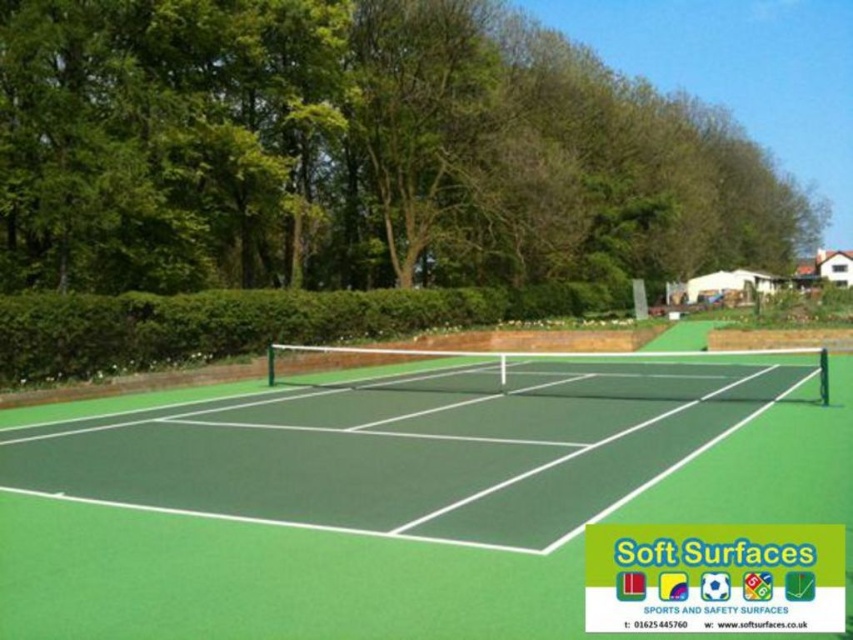
You are standing on the tennis court and want to locate the green leafy tree at upper center. According to the coordinates provided, where should you look?

The green leafy tree at upper center is located at coordinates point [357,152].

You are a tennis player standing on the green rubber tennis court at center. You want to hit a ball towards the green leafy tree at upper center. Is the tree above or below your current position?

The green leafy tree at upper center is located above the green rubber tennis court at center, so the tree is above your current position.